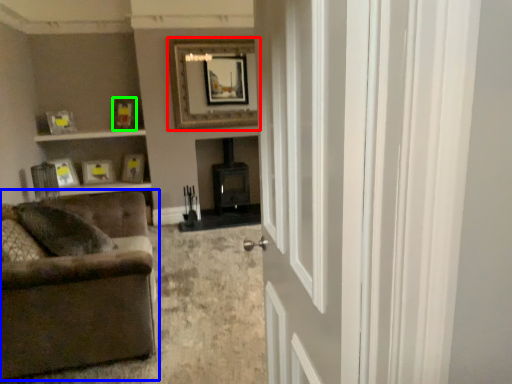
Question: Which object is the farthest from picture frame (highlighted by a red box)? Choose among these: studio couch (highlighted by a blue box) or picture frame (highlighted by a green box).

Choices:
 (A) studio couch
 (B) picture frame

Answer: (A)